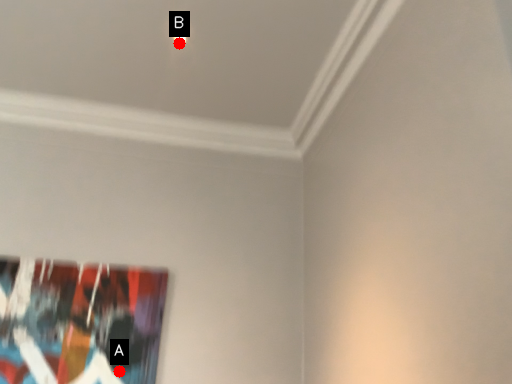
Question: Two points are circled on the image, labeled by A and B beside each circle. Among these points, which one is farthest from the camera?

Choices:
 (A) A is further
 (B) B is further

Answer: (A)